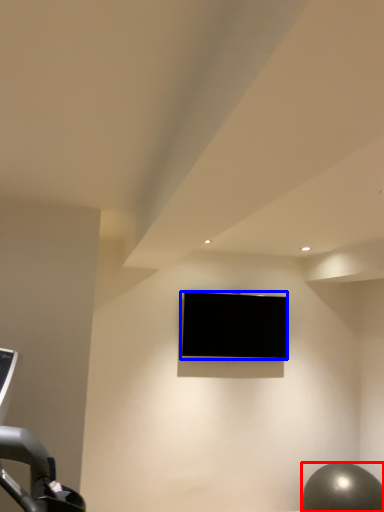
Question: Which point is further to the camera, ball (highlighted by a red box) or television (highlighted by a blue box)?

Choices:
 (A) ball
 (B) television

Answer: (B)